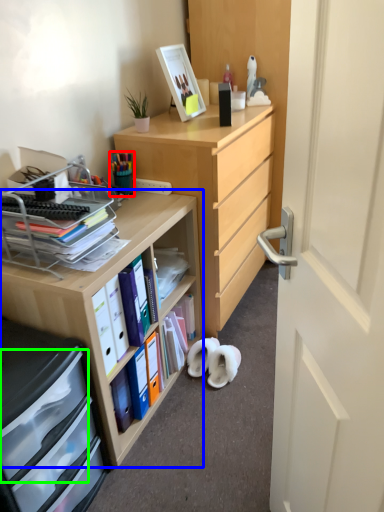
Question: Based on their relative distances, which object is nearer to stationery (highlighted by a red box)? Choose from desk (highlighted by a blue box) and drawer (highlighted by a green box).

Choices:
 (A) desk
 (B) drawer

Answer: (A)